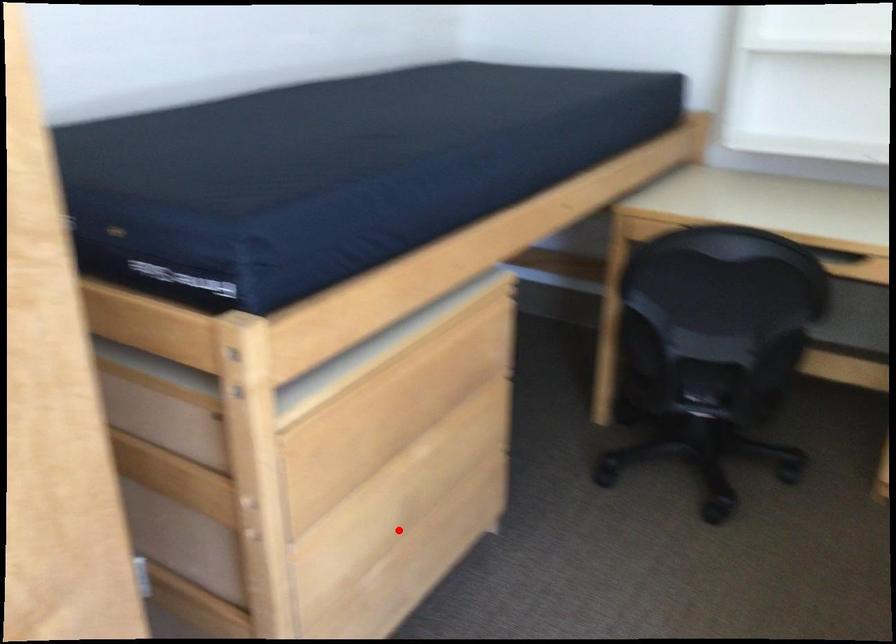
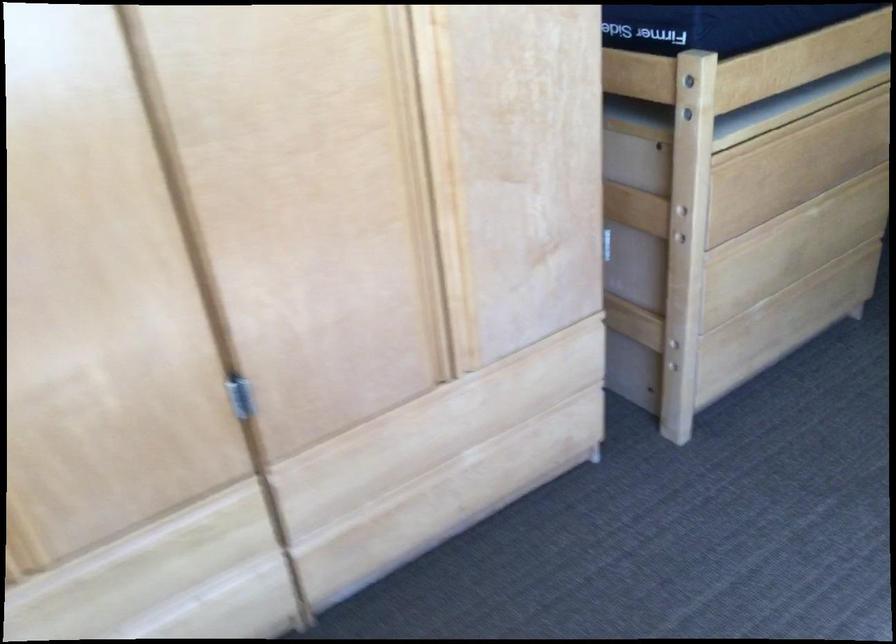
Question: I am providing you with two images of the same scene from different viewpoints. In image1, a red point is highlighted. Considering the same 3D point in image2, which of the following is correct?

Choices:
 (A) It is closer
 (B) It is farther

Answer: (B)